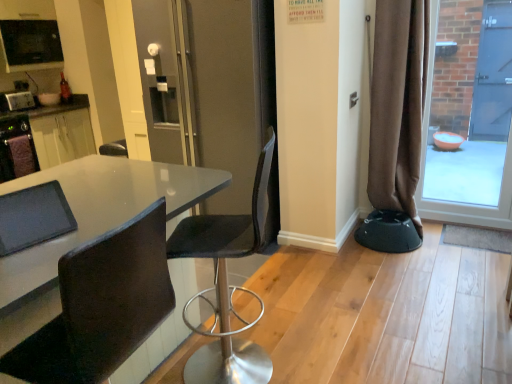
Question: Is black leather chair at lower left, the second chair viewed from the back, bigger than matte black screen door at center?

Choices:
 (A) no
 (B) yes

Answer: (A)

Question: Can you confirm if black leather chair at lower left, the second chair viewed from the back, is positioned to the left of matte black screen door at center?

Choices:
 (A) yes
 (B) no

Answer: (A)

Question: From a real-world perspective, is black leather chair at lower left, arranged as the first chair when viewed from the front, over matte black screen door at center?

Choices:
 (A) no
 (B) yes

Answer: (A)

Question: Is black leather chair at lower left, arranged as the first chair when viewed from the front, wider than matte black screen door at center?

Choices:
 (A) yes
 (B) no

Answer: (B)

Question: Is black leather chair at lower left, the second chair viewed from the back, closer to camera compared to matte black screen door at center?

Choices:
 (A) yes
 (B) no

Answer: (A)

Question: Is black leather chair at lower left, arranged as the first chair when viewed from the front, facing towards matte black screen door at center?

Choices:
 (A) yes
 (B) no

Answer: (B)

Question: Is black leather chair at lower left, arranged as the first chair when viewed from the front, surrounded by black mesh chair at center, which appears as the second chair when viewed from the front?

Choices:
 (A) no
 (B) yes

Answer: (A)

Question: Does black mesh chair at center, which appears as the second chair when viewed from the front, come in front of black leather chair at lower left, arranged as the first chair when viewed from the front?

Choices:
 (A) yes
 (B) no

Answer: (B)

Question: Does black mesh chair at center, positioned as the first chair in back-to-front order, have a lesser height compared to black leather chair at lower left, the second chair viewed from the back?

Choices:
 (A) no
 (B) yes

Answer: (A)

Question: Is black mesh chair at center, positioned as the first chair in back-to-front order, to the left of black leather chair at lower left, the second chair viewed from the back, from the viewer's perspective?

Choices:
 (A) yes
 (B) no

Answer: (B)

Question: From a real-world perspective, is black mesh chair at center, which appears as the second chair when viewed from the front, positioned under black leather chair at lower left, arranged as the first chair when viewed from the front, based on gravity?

Choices:
 (A) no
 (B) yes

Answer: (B)

Question: Could you tell me if black mesh chair at center, which appears as the second chair when viewed from the front, is turned towards black leather chair at lower left, the second chair viewed from the back?

Choices:
 (A) yes
 (B) no

Answer: (B)

Question: Does glossy white table at center appear on the left side of black plastic bar stool at lower right?

Choices:
 (A) yes
 (B) no

Answer: (A)